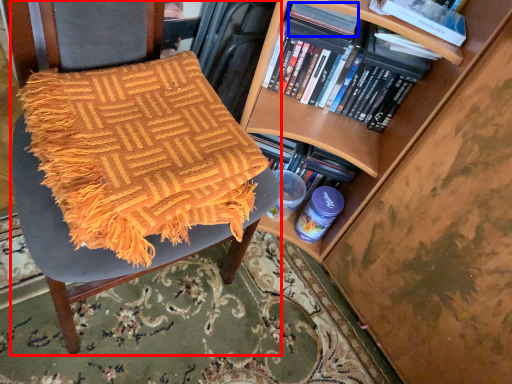
Question: Among these objects, which one is farthest to the camera, chair (highlighted by a red box) or paperback book (highlighted by a blue box)?

Choices:
 (A) chair
 (B) paperback book

Answer: (B)